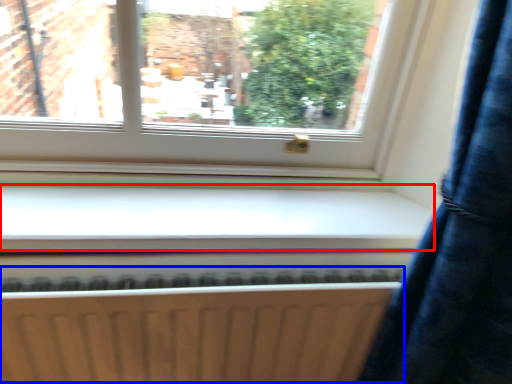
Question: Which object is further to the camera taking this photo, window sill (highlighted by a red box) or radiator (highlighted by a blue box)?

Choices:
 (A) window sill
 (B) radiator

Answer: (A)